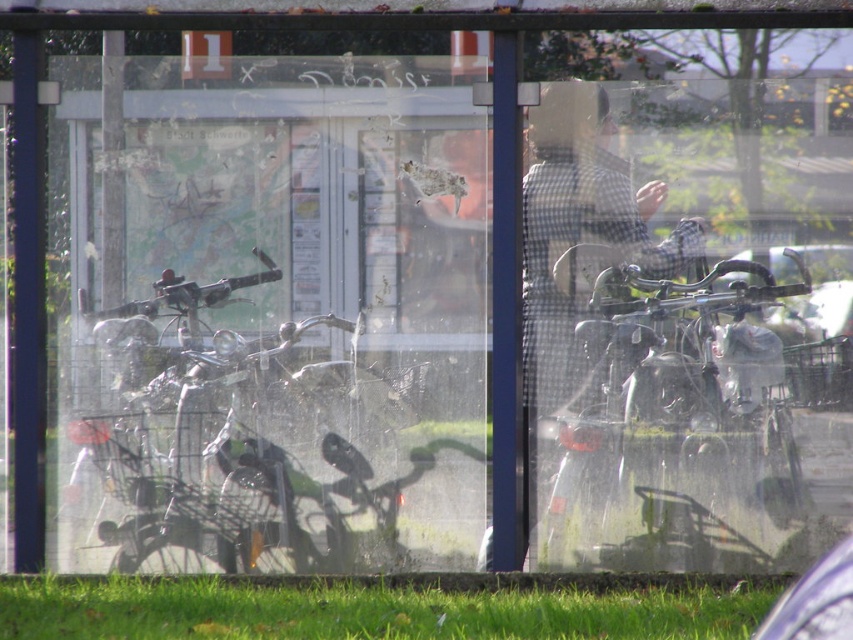
Is metallic silver motorcycle at left below green grass at lower center?

No.

Find the location of a particular element. The image size is (853, 640). metallic silver motorcycle at left is located at coordinates (242, 444).

Is point (264, 424) positioned in front of point (105, 625)?

No, it is not.

You are a GUI agent. You are given a task and a screenshot of the screen. Output one action in this format:
    pyautogui.click(x=<x>, y=<y>)
    Task: Click on the metallic silver motorcycle at left
    Image resolution: width=853 pixels, height=640 pixels.
    Given the screenshot: What is the action you would take?
    (242, 444)

How distant is metallic silver motorcycle at center from green grass at lower center?

metallic silver motorcycle at center and green grass at lower center are 23.77 inches apart from each other.

Between metallic silver motorcycle at center and green grass at lower center, which one is positioned higher?

metallic silver motorcycle at center is higher up.

Is point (602, 304) more distant than point (708, 612)?

Yes.

Where is `metallic silver motorcycle at center`? metallic silver motorcycle at center is located at coordinates (679, 422).

Can you confirm if metallic silver motorcycle at center is positioned to the right of metallic gun at left?

Yes, metallic silver motorcycle at center is to the right of metallic gun at left.

How much distance is there between metallic silver motorcycle at center and metallic gun at left?

metallic silver motorcycle at center is 37.93 inches from metallic gun at left.

Locate an element on the screen. metallic silver motorcycle at center is located at coordinates (679, 422).

Find the location of a particular element. This screenshot has width=853, height=640. metallic silver motorcycle at center is located at coordinates (679, 422).